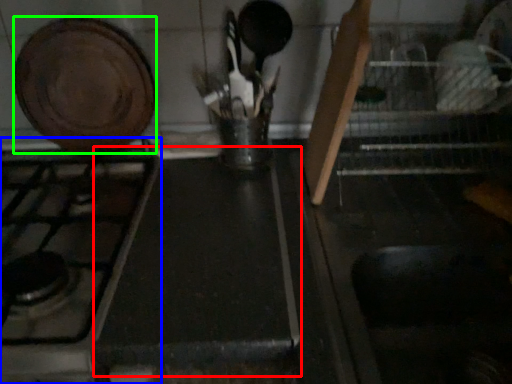
Question: Which object is positioned closest to counter top (highlighted by a red box)? Select from gas stove (highlighted by a blue box) and kitchen appliance (highlighted by a green box).

Choices:
 (A) gas stove
 (B) kitchen appliance

Answer: (A)